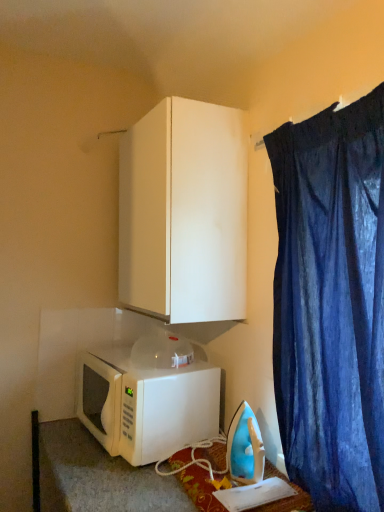
Question: From a real-world perspective, relative to blue plastic iron at lower right, is white matte cabinet at upper center vertically above or below?

Choices:
 (A) below
 (B) above

Answer: (B)

Question: Is white matte cabinet at upper center in front of or behind blue plastic iron at lower right in the image?

Choices:
 (A) behind
 (B) front

Answer: (A)

Question: Based on their relative distances, which object is nearer to the dark blue fabric at upper right?

Choices:
 (A) white matte cabinet at upper center
 (B) blue plastic iron at lower right
 (C) white matte microwave at lower left

Answer: (A)

Question: Which object is the closest to the white matte cabinet at upper center?

Choices:
 (A) white matte microwave at lower left
 (B) blue plastic iron at lower right
 (C) dark blue fabric at upper right

Answer: (C)